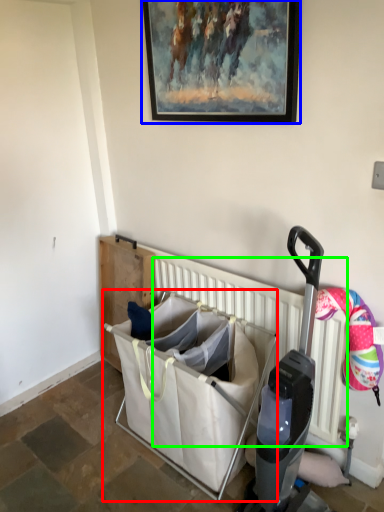
Question: Considering the real-world distances, which object is closest to baby carriage (highlighted by a red box)? picture frame (highlighted by a blue box) or radiator (highlighted by a green box).

Choices:
 (A) picture frame
 (B) radiator

Answer: (B)